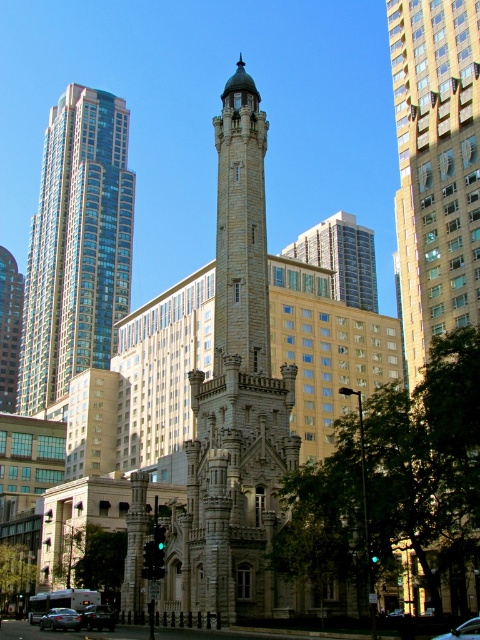
Who is shorter, shiny black sedan at lower left or shiny black sedan at lower right?

With less height is shiny black sedan at lower left.

Consider the image. Is shiny black sedan at lower left to the right of shiny black sedan at lower right from the viewer's perspective?

In fact, shiny black sedan at lower left is to the left of shiny black sedan at lower right.

Who is more distant from viewer, (69, 618) or (442, 637)?

The point (69, 618) is more distant.

Where is `shiny black sedan at lower left`? The image size is (480, 640). shiny black sedan at lower left is located at coordinates (60, 620).

Does shiny glass skyscraper at left lie in front of metallic silver car at lower left?

No, it is not.

Which is in front, point (67, 115) or point (88, 625)?

Positioned in front is point (88, 625).

The image size is (480, 640). Identify the location of shiny glass skyscraper at left. (76, 246).

Can you confirm if silver metallic building at center is smaller than metallic silver car at lower left?

No.

Does silver metallic building at center appear on the right side of metallic silver car at lower left?

Correct, you'll find silver metallic building at center to the right of metallic silver car at lower left.

Does point (365, 243) come farther from viewer compared to point (104, 605)?

Yes, point (365, 243) is farther from viewer.

Locate an element on the screen. The width and height of the screenshot is (480, 640). silver metallic building at center is located at coordinates (342, 257).